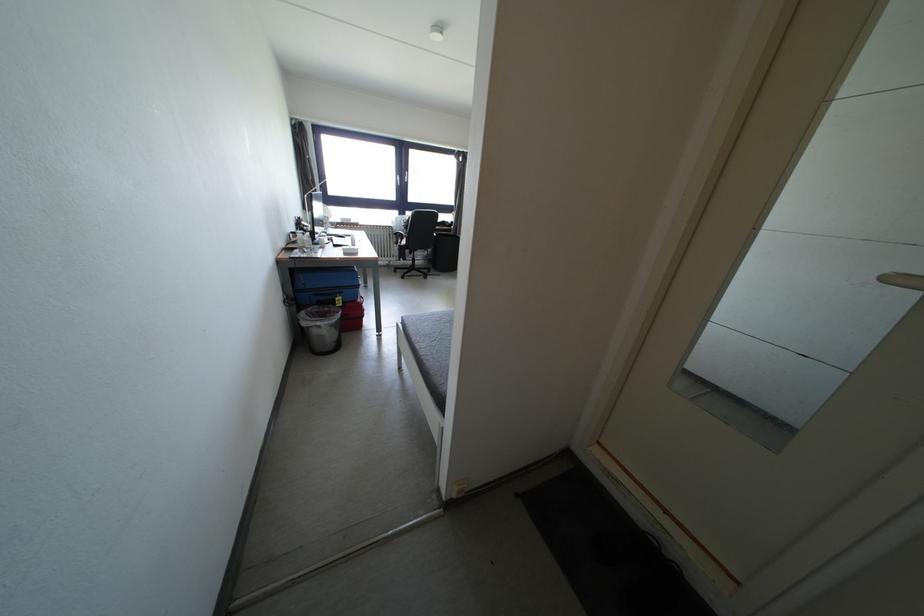
Find where to turn the white door handle. Please return your answer as a coordinate pair (x, y).

(902, 280)